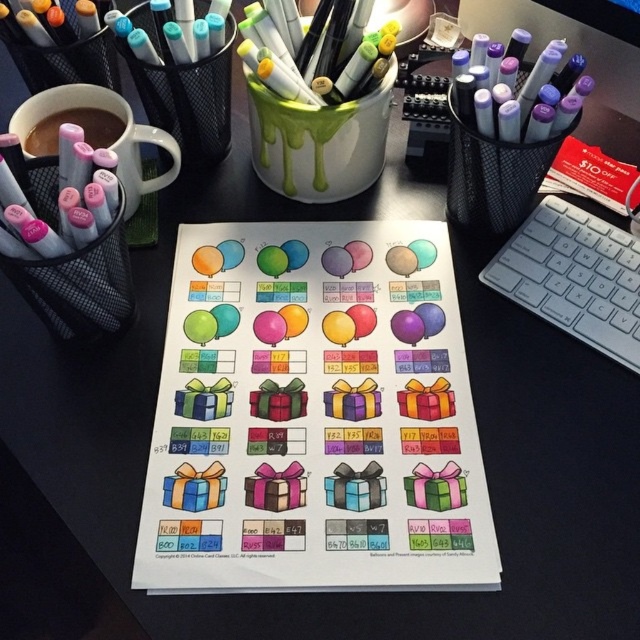
Is the position of purple matte marker at upper right more distant than that of brown matte mug at upper left?

No, purple matte marker at upper right is in front of brown matte mug at upper left.

Between purple matte marker at upper right and brown matte mug at upper left, which one appears on the left side from the viewer's perspective?

brown matte mug at upper left

Between point (465, 198) and point (60, 122), which one is positioned behind?

The point (465, 198) is more distant.

Locate an element on the screen. This screenshot has height=640, width=640. purple matte marker at upper right is located at coordinates (508, 140).

Is point (513, 120) farther from camera compared to point (547, 250)?

No.

Can you confirm if purple matte marker at upper right is positioned to the left of white plastic keyboard at right?

Yes, purple matte marker at upper right is to the left of white plastic keyboard at right.

Describe the element at coordinates (508, 140) in the screenshot. The height and width of the screenshot is (640, 640). I see `purple matte marker at upper right` at that location.

The width and height of the screenshot is (640, 640). I want to click on purple matte marker at upper right, so click(x=508, y=140).

Is point (556, 150) in front of point (61, 100)?

Yes, point (556, 150) is in front of point (61, 100).

Is purple matte marker at upper right thinner than matte white mug at upper left?

Yes.

Where is `purple matte marker at upper right`? This screenshot has width=640, height=640. purple matte marker at upper right is located at coordinates (508, 140).